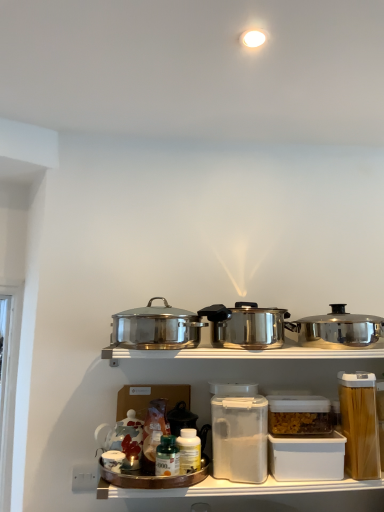
Identify the location of vacant space in between white plastic container at lower center and white plastic bottle at center, the 1th bottle in the right-to-left sequence. (240, 480).